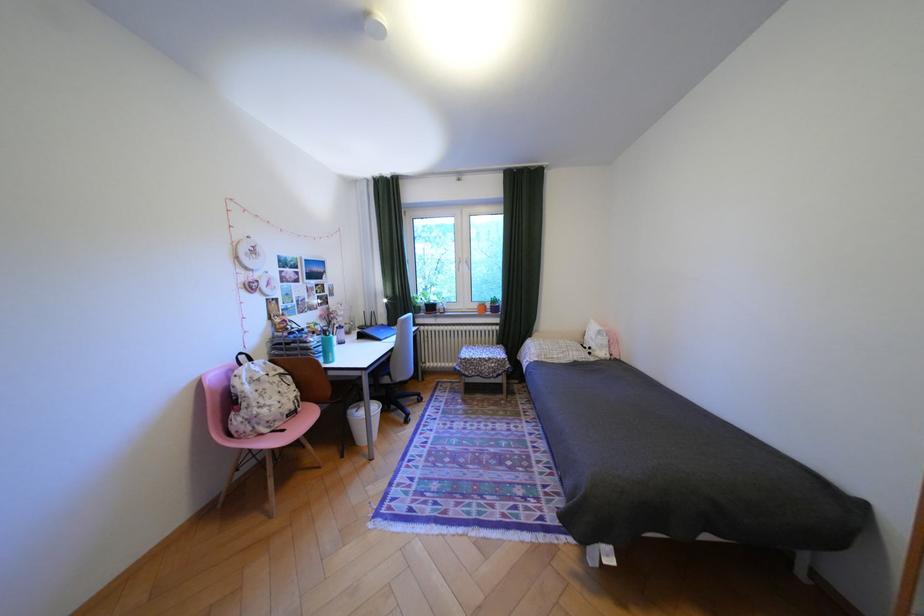
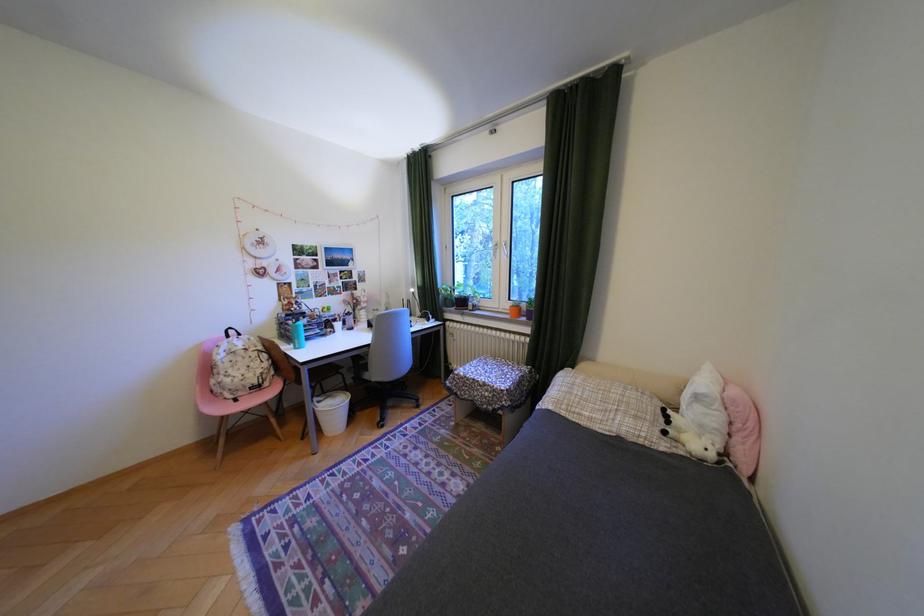
In the second image, find the point that corresponds to [289,424] in the first image.

(251, 394)